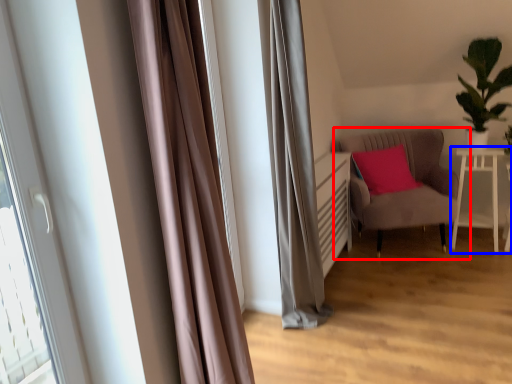
Question: Among these objects, which one is farthest to the camera, chair (highlighted by a red box) or table (highlighted by a blue box)?

Choices:
 (A) chair
 (B) table

Answer: (B)